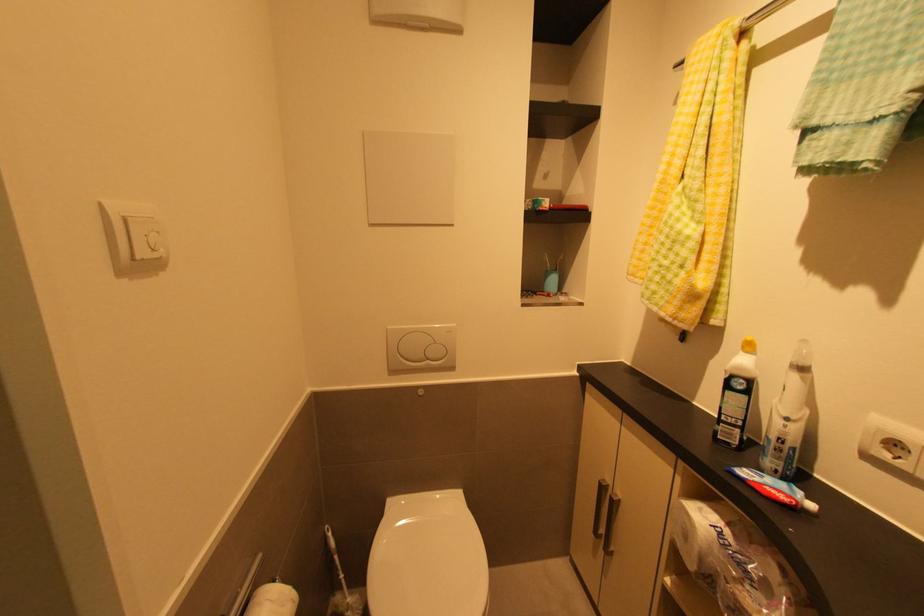
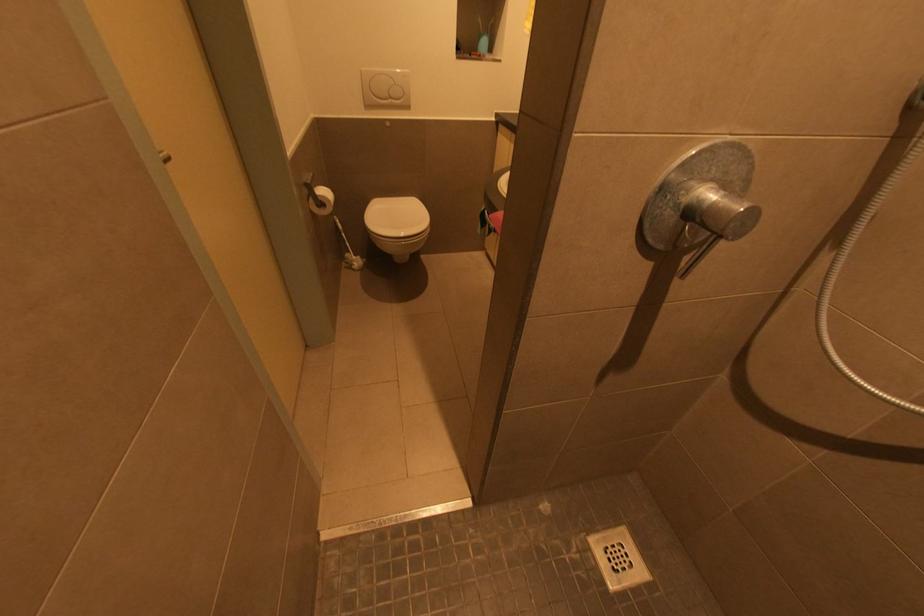
Question: What movement of the cameraman would produce the second image?

Choices:
 (A) Left
 (B) Right
 (C) Forward
 (D) Backward

Answer: (D)